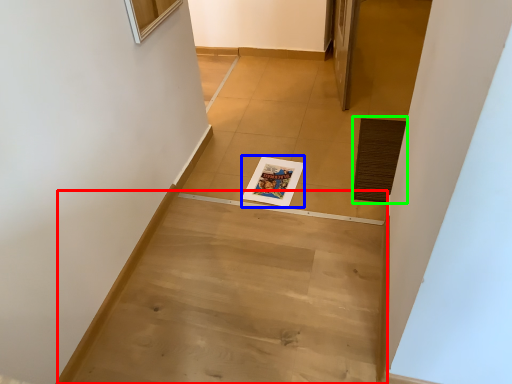
Question: Based on their relative distances, which object is farther from stairwell (highlighted by a red box)? Choose from magazine (highlighted by a blue box) and doormat (highlighted by a green box).

Choices:
 (A) magazine
 (B) doormat

Answer: (B)